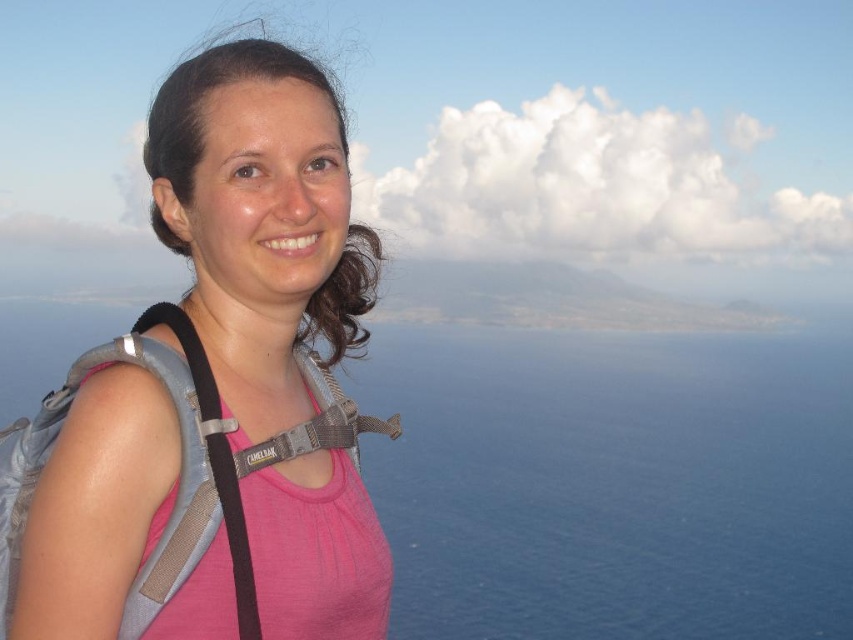
You are a drone operator who needs to capture a photo of the blue water at center and the pink fabric shirt at left. The camera has a maximum focus range of 2000 feet. Will you be able to capture both objects in focus at the same time?

The blue water at center and pink fabric shirt at left are 1911.09 feet apart from each other. Since the distance is within the camera maximum focus range of 2000 feet, the drone operator can capture both objects in focus at the same time.

You are a photographer trying to capture the blue water at center and the pink fabric shirt at left in a single frame. Which object should you focus on first if you want to ensure both are in the frame without moving the camera?

The blue water at center is larger in size than the pink fabric shirt at left, so you should focus on the blue water at center first to ensure it fits within the frame, then adjust to include the pink fabric shirt at left.